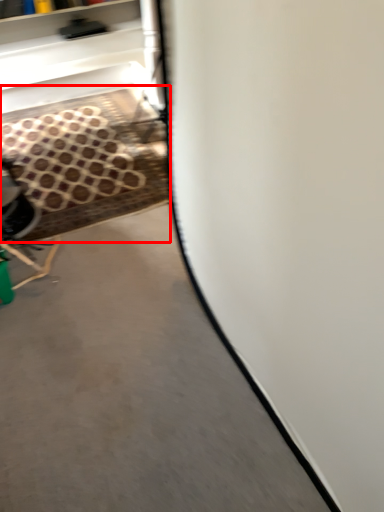
Question: Where is stair (annotated by the red box) located in relation to concrete in the image?

Choices:
 (A) right
 (B) left

Answer: (B)